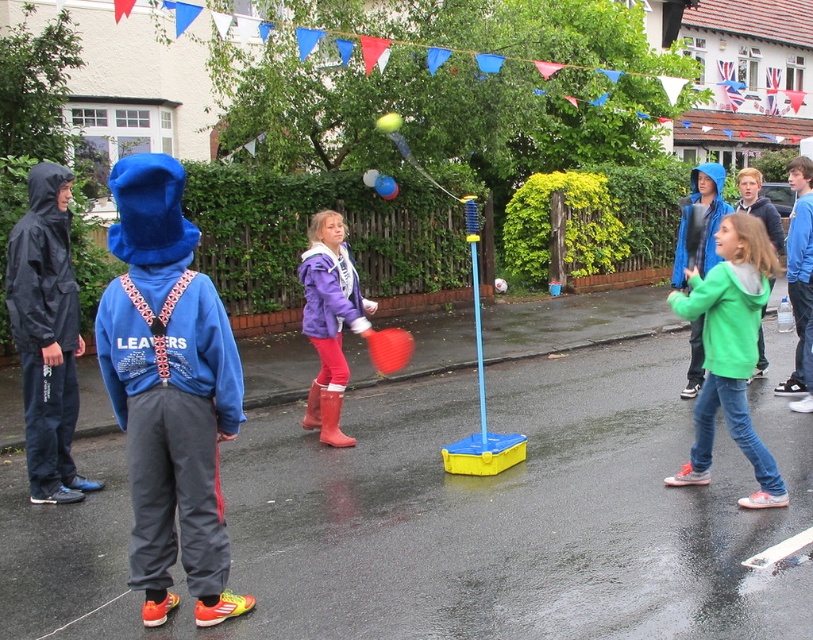
Can you confirm if green fleece jacket at right is taller than purple fleece jacket at center?

No, green fleece jacket at right is not taller than purple fleece jacket at center.

Which is more to the right, green fleece jacket at right or purple fleece jacket at center?

Positioned to the right is green fleece jacket at right.

Is point (720, 396) closer to camera compared to point (327, 214)?

Yes, point (720, 396) is closer to viewer.

Locate an element on the screen. green fleece jacket at right is located at coordinates (729, 352).